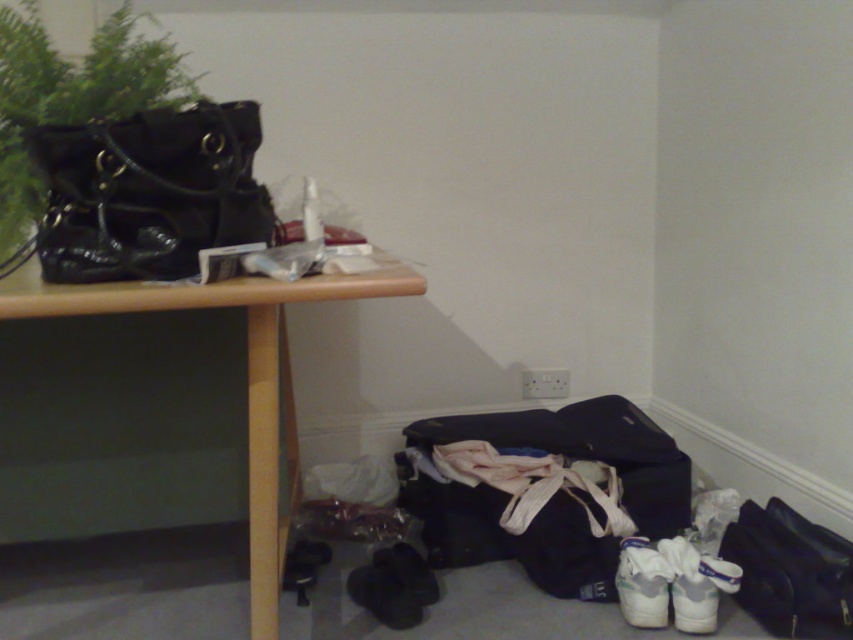
Which is more to the right, wooden table at upper left or green matte plant at upper left?

From the viewer's perspective, wooden table at upper left appears more on the right side.

Is point (395, 275) positioned behind point (82, 74)?

No, (395, 275) is in front of (82, 74).

I want to click on wooden table at upper left, so click(247, 374).

Identify the location of wooden table at upper left. (247, 374).

Is black leather handbag at upper left shorter than green matte plant at upper left?

Yes.

Between black leather handbag at upper left and green matte plant at upper left, which one has more height?

green matte plant at upper left is taller.

Which is in front, point (57, 148) or point (48, 49)?

Point (57, 148)

Locate an element on the screen. Image resolution: width=853 pixels, height=640 pixels. black leather handbag at upper left is located at coordinates (148, 192).

Describe the element at coordinates (148, 192) in the screenshot. The image size is (853, 640). I see `black leather handbag at upper left` at that location.

Can you confirm if black leather handbag at upper left is positioned to the right of wooden table at upper left?

In fact, black leather handbag at upper left is to the left of wooden table at upper left.

Which is in front, point (125, 184) or point (363, 280)?

Positioned in front is point (363, 280).

Locate an element on the screen. black leather handbag at upper left is located at coordinates (148, 192).